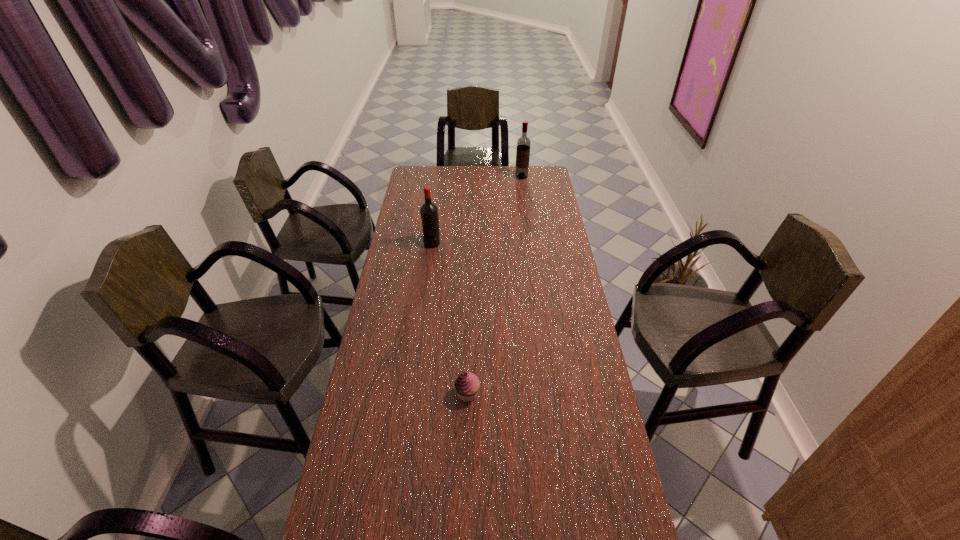
The height and width of the screenshot is (540, 960). What are the coordinates of `the farthest object` in the screenshot? It's located at (523, 143).

Where is `the farther wine bottle`? the farther wine bottle is located at coordinates (523, 143).

Where is `the left wine bottle`? The width and height of the screenshot is (960, 540). the left wine bottle is located at coordinates (429, 212).

You are a GUI agent. You are given a task and a screenshot of the screen. Output one action in this format:
    pyautogui.click(x=<x>, y=<y>)
    Task: Click on the nearer wine bottle
    The width and height of the screenshot is (960, 540).
    Given the screenshot: What is the action you would take?
    pyautogui.click(x=429, y=212)

The image size is (960, 540). What are the coordinates of `the shortest object` in the screenshot? It's located at (x=467, y=385).

The image size is (960, 540). I want to click on the second object from left to right, so click(467, 385).

Where is `vacant space situated on the front of the right wine bottle`? This screenshot has height=540, width=960. vacant space situated on the front of the right wine bottle is located at coordinates (527, 215).

Locate an element on the screen. Image resolution: width=960 pixels, height=540 pixels. vacant space located on the front of the leftmost object is located at coordinates (429, 264).

Where is `vacant position located 0.250m on the left of the second object from right to left`? The width and height of the screenshot is (960, 540). vacant position located 0.250m on the left of the second object from right to left is located at coordinates (375, 394).

Locate an element on the screen. The width and height of the screenshot is (960, 540). object at the far edge is located at coordinates (523, 143).